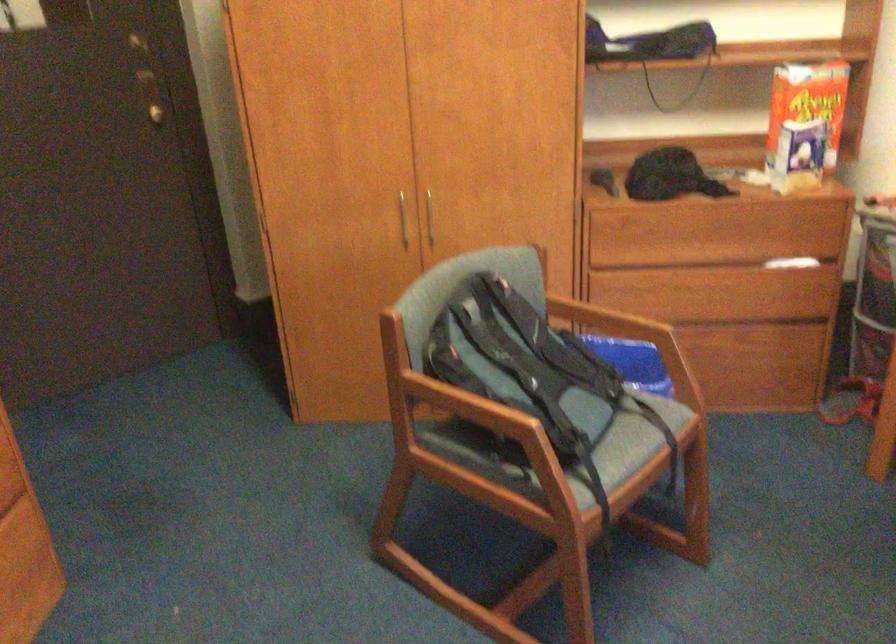
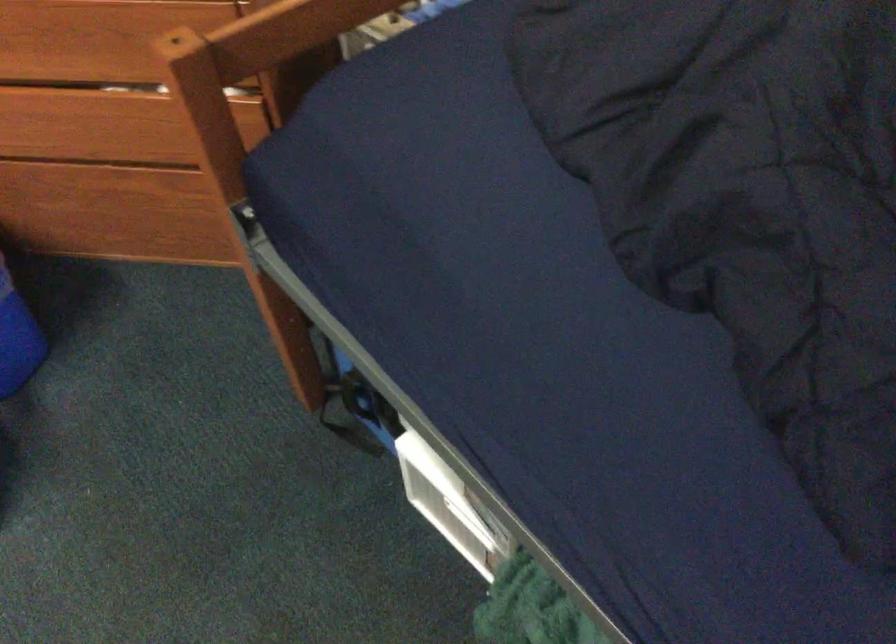
The images are taken continuously from a first-person perspective. In which direction are you moving?

The movement direction of the cameraman is right, forward.